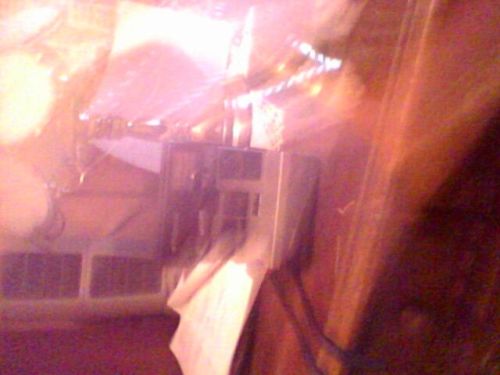
Find the location of a particular element. The image size is (500, 375). shelf of some kind is located at coordinates (263, 194).